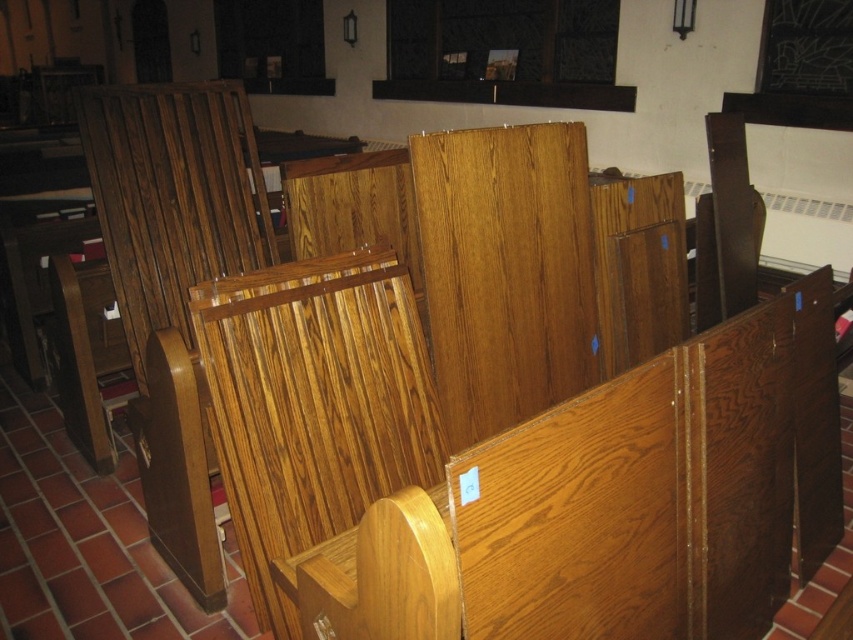
You are an interior designer assessing the space for accessibility. You need to ensure that the wooden church bench at center and the wooden panel at center are positioned in a way that allows wheelchair access between them. Based on their heights, can you determine if there is an obstruction for wheelchair movement?

The wooden church bench at center has a lesser height compared to wooden panel at center. Since the bench is shorter, it is less likely to obstruct wheelchair access. However, the taller wooden panel at center could potentially create an obstruction depending on its placement and the wheelchair user.

You are standing at the entrance of the church and want to place a new wooden church bench at center. According to the coordinates provided, where should you place it?

The wooden church bench at center should be placed at coordinates point (740, 461).